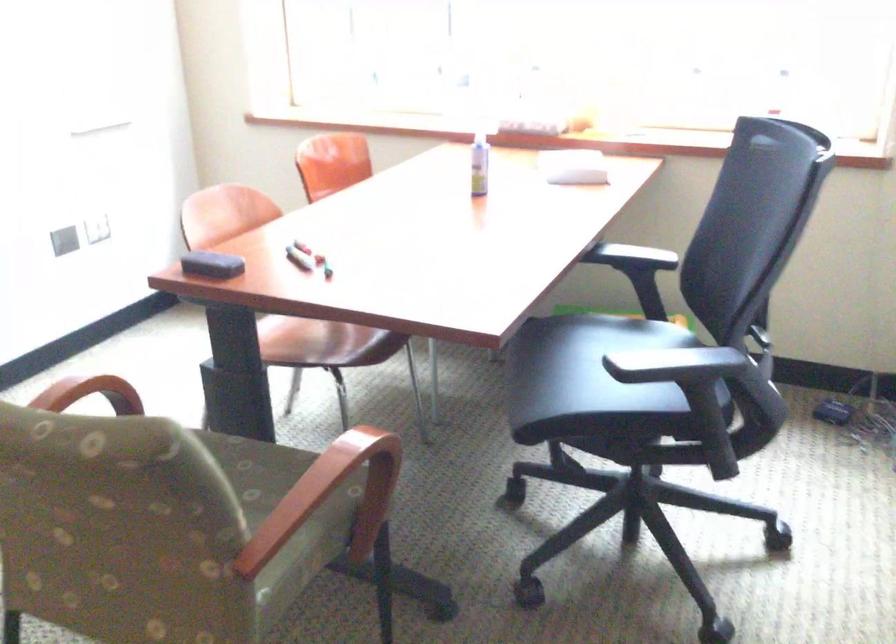
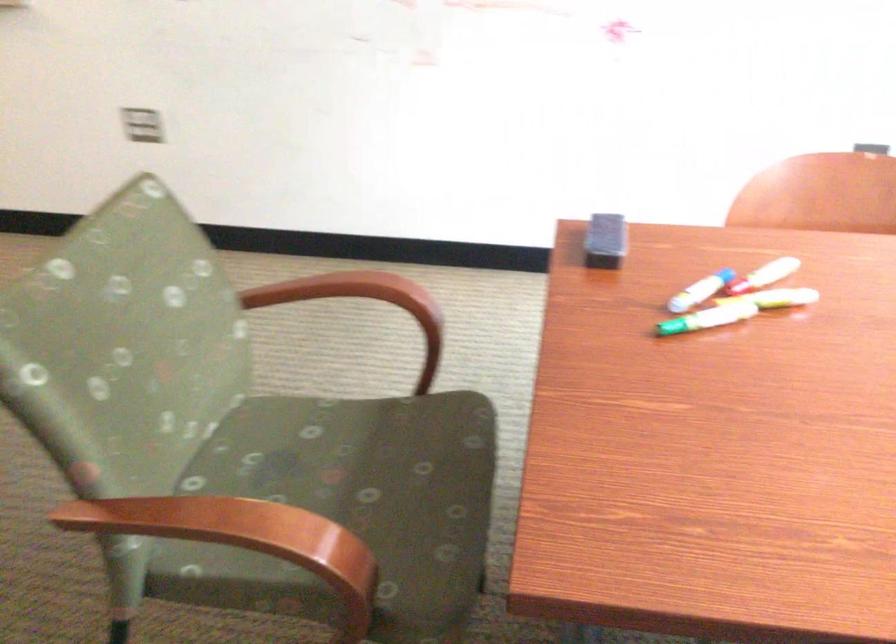
Find the pixel in the second image that matches the point at 329,269 in the first image.

(675, 327)